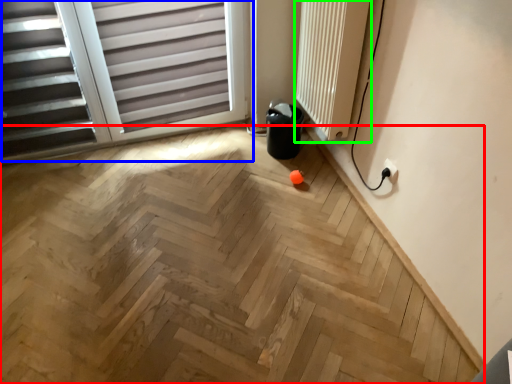
Question: Which is nearer to the plywood (highlighted by a red box)? window (highlighted by a blue box) or radiator (highlighted by a green box).

Choices:
 (A) window
 (B) radiator

Answer: (A)